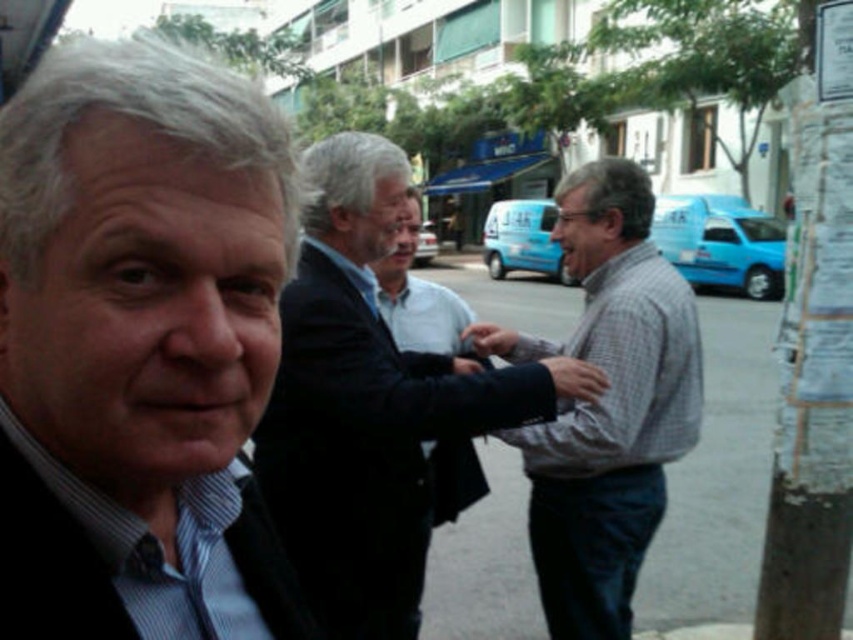
Which is behind, point (202, 394) or point (537, 460)?

The point (537, 460) is more distant.

Is matte black suit at left shorter than gray checkered shirt at center?

Yes.

Based on the photo, who is more forward, (175, 240) or (637, 173)?

Positioned in front is point (175, 240).

This screenshot has height=640, width=853. Identify the location of matte black suit at left. (148, 285).

Is point (144, 80) closer to camera compared to point (798, 356)?

Yes, it is.

Who is more distant from viewer, [120,218] or [836,323]?

Point [836,323]

Between point (276, 602) and point (804, 129), which one is positioned behind?

The point (804, 129) is more distant.

I want to click on matte black suit at left, so click(148, 285).

Is point (379, 474) closer to camera compared to point (627, 545)?

Yes.

Looking at this image, which of these two, dark blue suit at center or gray checkered shirt at center, stands taller?

Standing taller between the two is gray checkered shirt at center.

Is point (521, 388) positioned behind point (693, 440)?

No, (521, 388) is closer to viewer.

Locate an element on the screen. This screenshot has width=853, height=640. dark blue suit at center is located at coordinates [375, 406].